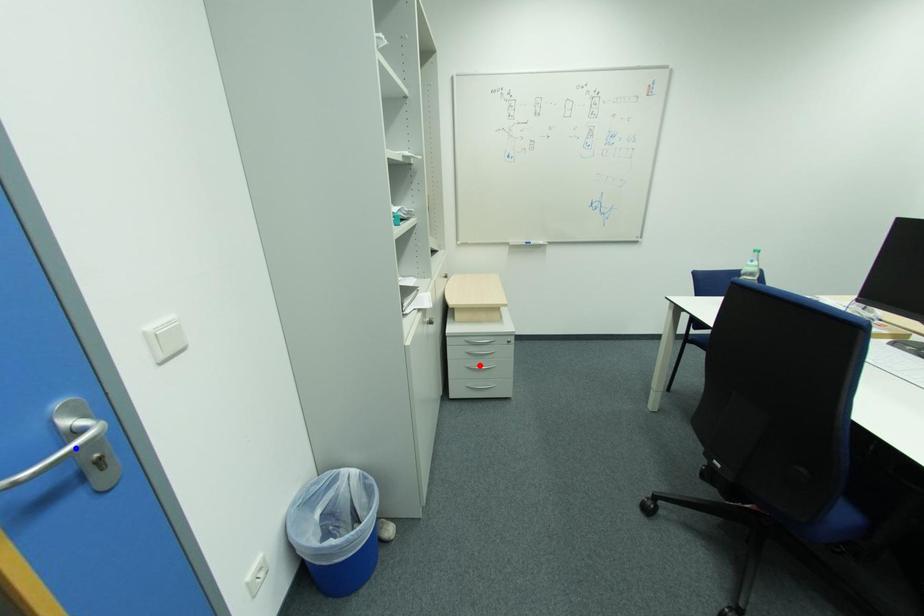
Question: Which of the two points in the image is closer to the camera?

Choices:
 (A) Blue point is closer.
 (B) Red point is closer.

Answer: (A)